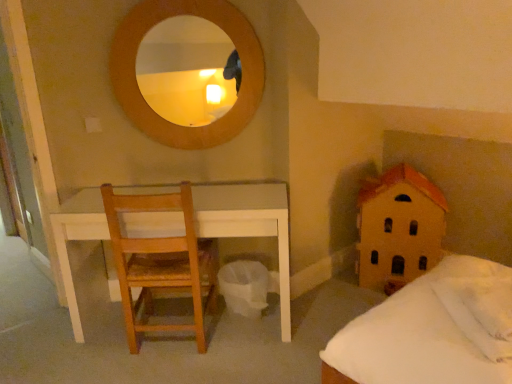
Identify the location of wooden house at right. The width and height of the screenshot is (512, 384). (398, 228).

The image size is (512, 384). What do you see at coordinates (489, 303) in the screenshot?
I see `white fluffy pillow at lower right, which ranks as the 2th pillow in front-to-back order` at bounding box center [489, 303].

What is the approximate height of white fluffy pillow at lower right, which is the first pillow in back-to-front order?

white fluffy pillow at lower right, which is the first pillow in back-to-front order, is 7.17 centimeters in height.

What are the coordinates of `wooden house at right` in the screenshot? It's located at (398, 228).

Does wooden house at right have a lesser height compared to white soft pillow at lower right, which ranks as the second pillow in back-to-front order?

Incorrect, the height of wooden house at right does not fall short of that of white soft pillow at lower right, which ranks as the second pillow in back-to-front order.

Is wooden house at right far away from white soft pillow at lower right, which is counted as the 1th pillow, starting from the front?

No, wooden house at right is in close proximity to white soft pillow at lower right, which is counted as the 1th pillow, starting from the front.

In the scene shown: Is wooden house at right smaller than white soft pillow at lower right, which ranks as the second pillow in back-to-front order?

Actually, wooden house at right might be larger than white soft pillow at lower right, which ranks as the second pillow in back-to-front order.

Does wooden house at right have a greater width compared to white soft pillow at lower right, which is counted as the 1th pillow, starting from the front?

Yes.

Could white fluffy pillow at lower right, which ranks as the 2th pillow in front-to-back order, be considered to be inside white soft pillow at lower right, which is counted as the 1th pillow, starting from the front?

Yes, white fluffy pillow at lower right, which ranks as the 2th pillow in front-to-back order, is inside white soft pillow at lower right, which is counted as the 1th pillow, starting from the front.

Is white soft pillow at lower right, which ranks as the second pillow in back-to-front order, far from white fluffy pillow at lower right, which is the first pillow in back-to-front order?

No.

Is light brown wooden chair at left bigger than white soft pillow at lower right, which is counted as the 1th pillow, starting from the front?

Yes, light brown wooden chair at left is bigger than white soft pillow at lower right, which is counted as the 1th pillow, starting from the front.

How many degrees apart are the facing directions of light brown wooden chair at left and white soft pillow at lower right, which is counted as the 1th pillow, starting from the front?

There is a 92.3-degree angle between the facing directions of light brown wooden chair at left and white soft pillow at lower right, which is counted as the 1th pillow, starting from the front.

Which is closer, (177, 278) or (490, 328)?

Point (490, 328)

Consider the image. Which object is wider, light brown wooden chair at left or white soft pillow at lower right, which ranks as the second pillow in back-to-front order?

light brown wooden chair at left.

Based on the photo, does light brown wooden chair at left appear on the left side of white fluffy pillow at lower right, which is the first pillow in back-to-front order?

Yes.

Is light brown wooden chair at left turned away from white fluffy pillow at lower right, which ranks as the 2th pillow in front-to-back order?

No.

Who is shorter, light brown wooden chair at left or white fluffy pillow at lower right, which ranks as the 2th pillow in front-to-back order?

white fluffy pillow at lower right, which ranks as the 2th pillow in front-to-back order.

Image resolution: width=512 pixels, height=384 pixels. Identify the location of chair on the left of white fluffy pillow at lower right, which is the first pillow in back-to-front order. (162, 264).

Is wooden house at right situated inside white fluffy pillow at lower right, which is the first pillow in back-to-front order, or outside?

wooden house at right is not inside white fluffy pillow at lower right, which is the first pillow in back-to-front order, it's outside.

Image resolution: width=512 pixels, height=384 pixels. Identify the location of toy behind the white fluffy pillow at lower right, which ranks as the 2th pillow in front-to-back order. (398, 228).

From the image's perspective, is wooden house at right on top of white fluffy pillow at lower right, which ranks as the 2th pillow in front-to-back order?

Yes, from the image's perspective, wooden house at right is above white fluffy pillow at lower right, which ranks as the 2th pillow in front-to-back order.

What's the angular difference between wooden house at right and white fluffy pillow at lower right, which ranks as the 2th pillow in front-to-back order,'s facing directions?

73.5 degrees separate the facing orientations of wooden house at right and white fluffy pillow at lower right, which ranks as the 2th pillow in front-to-back order.

From the image's perspective, is white soft pillow at lower right, which ranks as the second pillow in back-to-front order, on light brown wooden chair at left?

No, from the image's perspective, white soft pillow at lower right, which ranks as the second pillow in back-to-front order, is not above light brown wooden chair at left.

How many degrees apart are the facing directions of white soft pillow at lower right, which is counted as the 1th pillow, starting from the front, and light brown wooden chair at left?

Answer: white soft pillow at lower right, which is counted as the 1th pillow, starting from the front, and light brown wooden chair at left are facing 92.3 degrees away from each other.

Does white soft pillow at lower right, which ranks as the second pillow in back-to-front order, have a greater height compared to light brown wooden chair at left?

Incorrect, the height of white soft pillow at lower right, which ranks as the second pillow in back-to-front order, is not larger of that of light brown wooden chair at left.

Would you say white fluffy pillow at lower right, which ranks as the 2th pillow in front-to-back order, is to the left or to the right of light brown wooden chair at left in the picture?

white fluffy pillow at lower right, which ranks as the 2th pillow in front-to-back order, is positioned on light brown wooden chair at left's right side.

Which object is closer to the camera, white fluffy pillow at lower right, which ranks as the 2th pillow in front-to-back order, or light brown wooden chair at left?

white fluffy pillow at lower right, which ranks as the 2th pillow in front-to-back order, is in front.

Are white fluffy pillow at lower right, which is the first pillow in back-to-front order, and light brown wooden chair at left located far from each other?

Indeed, white fluffy pillow at lower right, which is the first pillow in back-to-front order, is not near light brown wooden chair at left.

Looking at the image, does white fluffy pillow at lower right, which ranks as the 2th pillow in front-to-back order, seem bigger or smaller compared to light brown wooden chair at left?

white fluffy pillow at lower right, which ranks as the 2th pillow in front-to-back order, is smaller than light brown wooden chair at left.

Image resolution: width=512 pixels, height=384 pixels. I want to click on the 2nd pillow counting from the left of the wooden house at right, so click(x=480, y=311).

Where is `pillow above the white soft pillow at lower right, which is counted as the 1th pillow, starting from the front (from the image's perspective)`? The width and height of the screenshot is (512, 384). pillow above the white soft pillow at lower right, which is counted as the 1th pillow, starting from the front (from the image's perspective) is located at coordinates [x=489, y=303].

Based on their spatial positions, is white soft pillow at lower right, which is counted as the 1th pillow, starting from the front, or wooden house at right closer to white fluffy pillow at lower right, which ranks as the 2th pillow in front-to-back order?

white soft pillow at lower right, which is counted as the 1th pillow, starting from the front.

Estimate the real-world distances between objects in this image. Which object is further from white soft pillow at lower right, which is counted as the 1th pillow, starting from the front, white fluffy pillow at lower right, which is the first pillow in back-to-front order, or light brown wooden chair at left?

light brown wooden chair at left lies further to white soft pillow at lower right, which is counted as the 1th pillow, starting from the front, than the other object.

From the image, which object appears to be farther from light brown wooden chair at left, wooden house at right or white soft pillow at lower right, which ranks as the second pillow in back-to-front order?

white soft pillow at lower right, which ranks as the second pillow in back-to-front order, lies further to light brown wooden chair at left than the other object.

Based on the photo, from the image, which object appears to be farther from white soft pillow at lower right, which is counted as the 1th pillow, starting from the front, wooden house at right or light brown wooden chair at left?

light brown wooden chair at left is positioned further to the anchor white soft pillow at lower right, which is counted as the 1th pillow, starting from the front.

Considering their positions, is white soft pillow at lower right, which ranks as the second pillow in back-to-front order, positioned closer to light brown wooden chair at left than wooden house at right?

wooden house at right lies closer to light brown wooden chair at left than the other object.

Based on their spatial positions, is white soft pillow at lower right, which is counted as the 1th pillow, starting from the front, or light brown wooden chair at left closer to wooden house at right?

white soft pillow at lower right, which is counted as the 1th pillow, starting from the front, is closer to wooden house at right.

Estimate the real-world distances between objects in this image. Which object is further from white soft pillow at lower right, which is counted as the 1th pillow, starting from the front, white fluffy pillow at lower right, which is the first pillow in back-to-front order, or wooden house at right?

wooden house at right.

From the picture: Looking at the image, which one is located closer to white fluffy pillow at lower right, which is the first pillow in back-to-front order, light brown wooden chair at left or wooden house at right?

Based on the image, wooden house at right appears to be nearer to white fluffy pillow at lower right, which is the first pillow in back-to-front order.

The width and height of the screenshot is (512, 384). I want to click on pillow between light brown wooden chair at left and white fluffy pillow at lower right, which is the first pillow in back-to-front order, from left to right, so click(480, 311).

The height and width of the screenshot is (384, 512). In order to click on pillow between white soft pillow at lower right, which ranks as the second pillow in back-to-front order, and wooden house at right, along the z-axis in this screenshot , I will do `click(489, 303)`.